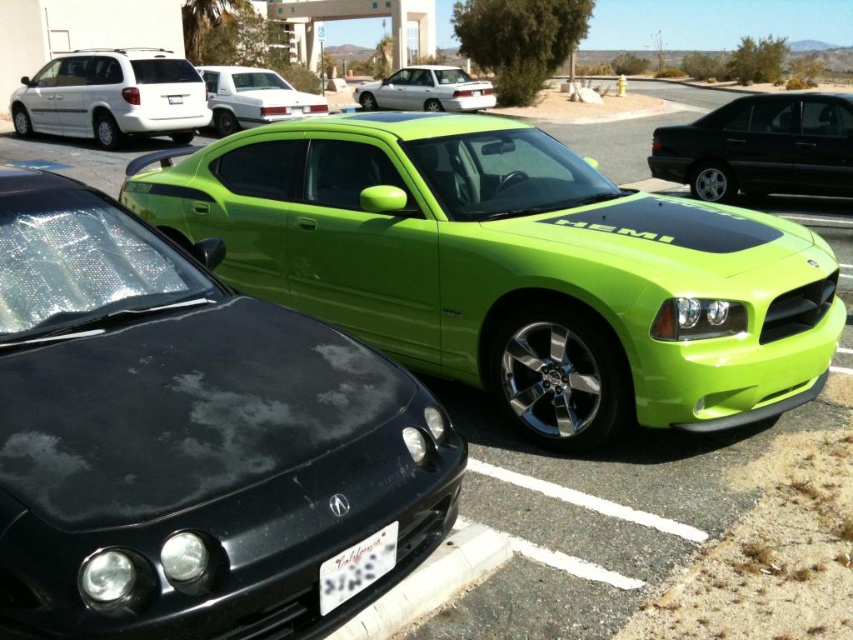
Consider the image. Is the position of silver metallic station wagon at center more distant than that of white plastic license plate at center?

Yes, it is behind white plastic license plate at center.

How much distance is there between silver metallic station wagon at center and white plastic license plate at center?

silver metallic station wagon at center is 12.95 meters away from white plastic license plate at center.

Is point (395, 84) closer to camera compared to point (172, 96)?

No, it is not.

The image size is (853, 640). Find the location of `silver metallic station wagon at center`. silver metallic station wagon at center is located at coordinates (426, 90).

Who is positioned more to the right, glossy black sedan at right or white glossy sedan at upper center?

Positioned to the right is glossy black sedan at right.

Is glossy black sedan at right bigger than white glossy sedan at upper center?

No.

Locate an element on the screen. Image resolution: width=853 pixels, height=640 pixels. glossy black sedan at right is located at coordinates (761, 147).

Does lime green matte car at center appear over glossy black sedan at right?

Actually, lime green matte car at center is below glossy black sedan at right.

Who is higher up, lime green matte car at center or glossy black sedan at right?

glossy black sedan at right

Does point (74, 317) come in front of point (833, 189)?

Yes, it is in front of point (833, 189).

Locate an element on the screen. This screenshot has height=640, width=853. lime green matte car at center is located at coordinates 187,436.